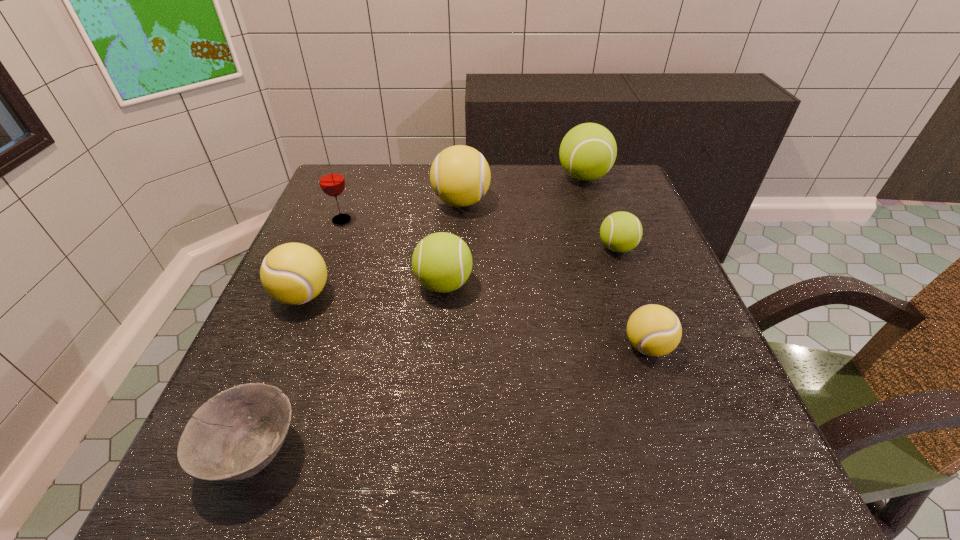
Where is `blank space located 0.060m on the front of the second nearest green tennis ball`? The image size is (960, 540). blank space located 0.060m on the front of the second nearest green tennis ball is located at coordinates (628, 280).

The image size is (960, 540). Identify the location of vacant area located on the back of the bowl. [x=310, y=305].

The height and width of the screenshot is (540, 960). Identify the location of object present at the near edge. (234, 435).

Image resolution: width=960 pixels, height=540 pixels. I want to click on glass that is at the left edge, so click(x=331, y=180).

Identify the location of tennis ball that is positioned at the left edge. (293, 273).

The height and width of the screenshot is (540, 960). Identify the location of bowl positioned at the left edge. (234, 435).

The image size is (960, 540). What are the coordinates of `object present at the near left corner` in the screenshot? It's located at (234, 435).

Find the location of a particular element. This screenshot has width=960, height=540. object that is at the far right corner is located at coordinates (588, 151).

This screenshot has height=540, width=960. I want to click on free region at the far edge of the desktop, so click(387, 201).

Locate an element on the screen. This screenshot has width=960, height=540. blank space at the near edge of the desktop is located at coordinates (344, 473).